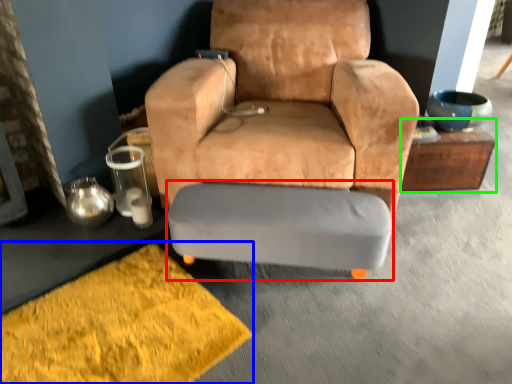
Question: Based on their relative distances, which object is farther from swivel chair (highlighted by a red box)? Choose from doormat (highlighted by a blue box) and table (highlighted by a green box).

Choices:
 (A) doormat
 (B) table

Answer: (B)